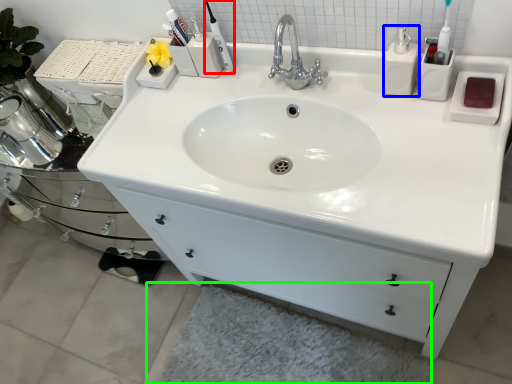
Question: Considering the real-world distances, which object is closest to toiletry (highlighted by a red box)? soap dispenser (highlighted by a blue box) or bath mat (highlighted by a green box).

Choices:
 (A) soap dispenser
 (B) bath mat

Answer: (A)